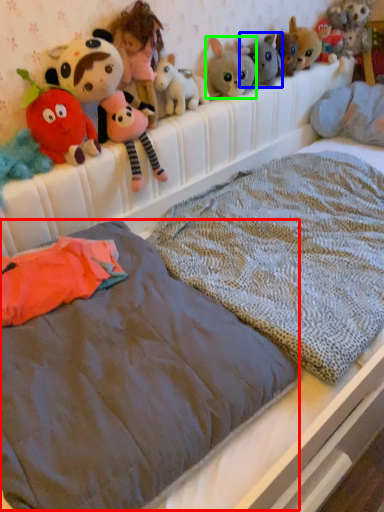
Question: Which is farther away from mattress (highlighted by a red box)? toy (highlighted by a blue box) or toy (highlighted by a green box)?

Choices:
 (A) toy
 (B) toy

Answer: (A)